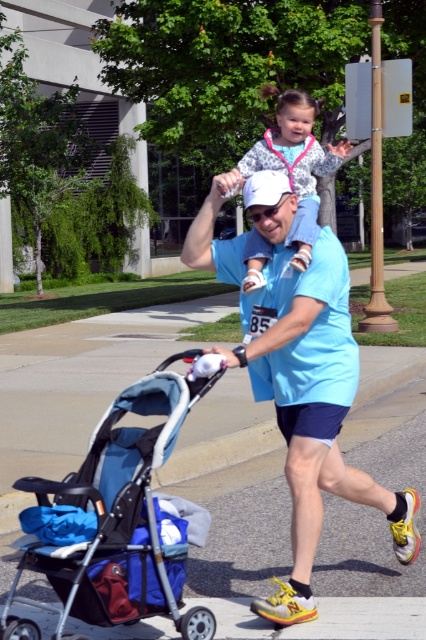
What do you see at coordinates (307, 388) in the screenshot? The image size is (426, 640). I see `light blue t-shirt at center` at bounding box center [307, 388].

You are a GUI agent. You are given a task and a screenshot of the screen. Output one action in this format:
    pyautogui.click(x=<x>, y=<y>)
    Task: Click on the light blue t-shirt at center
    
    Given the screenshot: What is the action you would take?
    pyautogui.click(x=307, y=388)

What are the coordinates of `light blue t-shirt at center` in the screenshot? It's located at (307, 388).

Is light blue t-shirt at center further to camera compared to blue fabric stroller at lower left?

Yes.

How far apart are light blue t-shirt at center and blue fabric stroller at lower left?

A distance of 39.12 inches exists between light blue t-shirt at center and blue fabric stroller at lower left.

Who is more forward, [301,497] or [63,609]?

Point [301,497] is in front.

The width and height of the screenshot is (426, 640). Identify the location of light blue t-shirt at center. (307, 388).

Is point (146, 483) positioned in front of point (258, 268)?

Yes, point (146, 483) is closer to viewer.

Where is `blue fabric stroller at lower left`? Image resolution: width=426 pixels, height=640 pixels. blue fabric stroller at lower left is located at coordinates (118, 518).